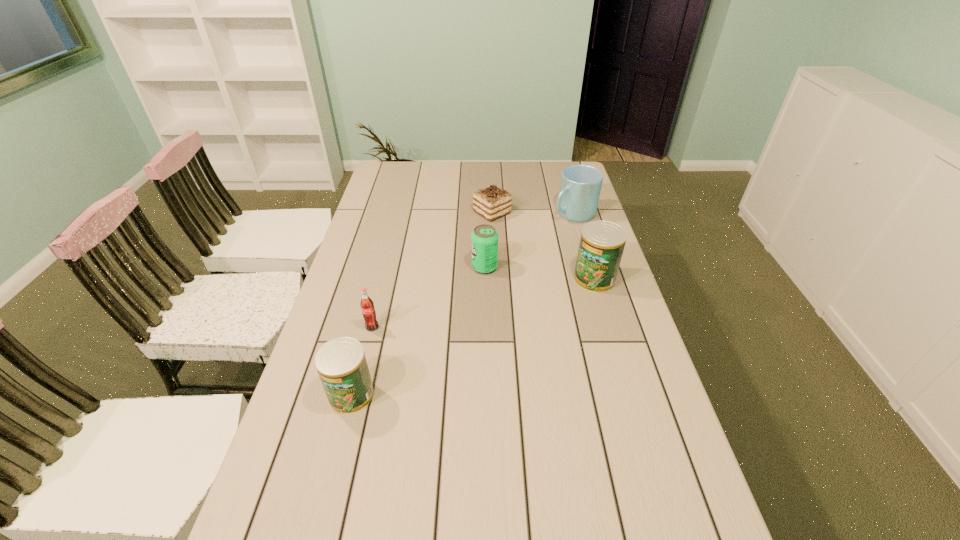
Locate an element on the screen. This screenshot has width=960, height=540. free space located on the left of the taller can is located at coordinates (468, 279).

This screenshot has width=960, height=540. What are the coordinates of `free region located 0.370m on the front of the shortest object` in the screenshot? It's located at (494, 290).

Locate an element on the screen. This screenshot has height=540, width=960. vacant space situated 0.290m on the front of the mug is located at coordinates (592, 276).

You are a GUI agent. You are given a task and a screenshot of the screen. Output one action in this format:
    pyautogui.click(x=<x>, y=<y>)
    Task: Click on the free location located on the front-facing side of the right soda bottle
    This screenshot has height=540, width=960.
    Given the screenshot: What is the action you would take?
    point(414,267)

Locate an element on the screen. The width and height of the screenshot is (960, 540). blank space located 0.130m on the front-facing side of the right soda bottle is located at coordinates (432, 267).

I want to click on vacant space located 0.310m on the front-facing side of the right soda bottle, so click(378, 267).

The height and width of the screenshot is (540, 960). Identify the location of vacant space located 0.240m on the label of the left soda bottle. (352, 407).

The width and height of the screenshot is (960, 540). I want to click on can that is positioned at the left edge, so click(x=341, y=364).

You are a GUI agent. You are given a task and a screenshot of the screen. Output one action in this format:
    pyautogui.click(x=<x>, y=<y>)
    Task: Click on the soda bottle located at the left edge
    
    Given the screenshot: What is the action you would take?
    pyautogui.click(x=367, y=306)

This screenshot has width=960, height=540. I want to click on can at the right edge, so [602, 243].